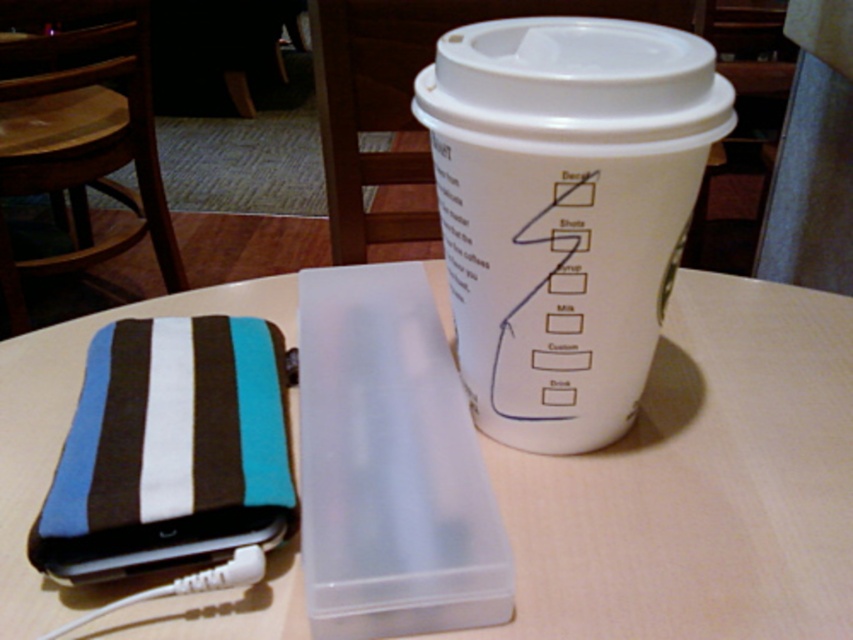
Question: Where is white plastic container at center located in relation to white paper cup at upper right in the image?

Choices:
 (A) above
 (B) below

Answer: (B)

Question: Does white plastic container at center appear over white paper cup at upper right?

Choices:
 (A) yes
 (B) no

Answer: (B)

Question: Does white plastic container at center come behind white paper cup at upper right?

Choices:
 (A) yes
 (B) no

Answer: (A)

Question: Which point is farther to the camera?

Choices:
 (A) white plastic container at center
 (B) white paper cup at upper right

Answer: (A)